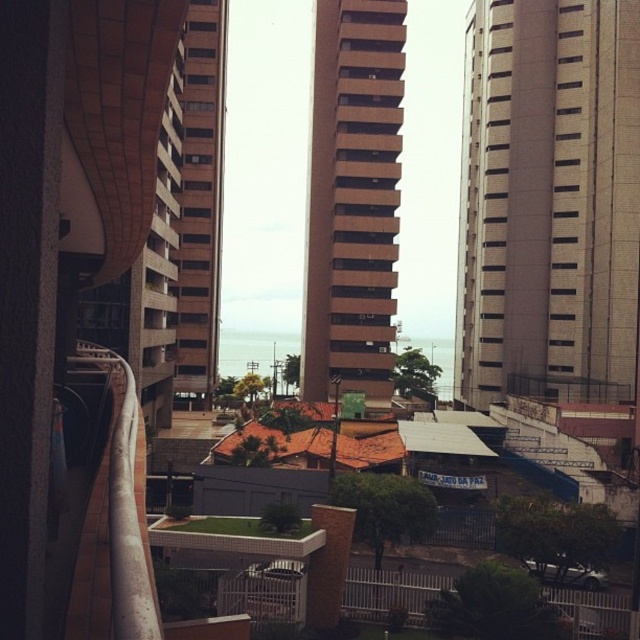
Question: Which point appears closest to the camera in this image?

Choices:
 (A) (355, 12)
 (B) (572, 616)

Answer: (B)

Question: Does gray concrete building at center have a greater width compared to white metal fence at lower center?

Choices:
 (A) no
 (B) yes

Answer: (A)

Question: Which object is farther from the camera taking this photo?

Choices:
 (A) white painted metal railing at left
 (B) white metal fence at lower center
 (C) brown concrete building at center
 (D) gray concrete building at center

Answer: (D)

Question: Does gray concrete building at center have a larger size compared to white painted metal railing at left?

Choices:
 (A) no
 (B) yes

Answer: (B)

Question: In this image, where is gray concrete building at center located relative to white metal fence at lower center?

Choices:
 (A) left
 (B) right

Answer: (B)

Question: Which point is farther to the camera?

Choices:
 (A) brown concrete building at center
 (B) gray concrete building at center
 (C) white painted metal railing at left

Answer: (B)